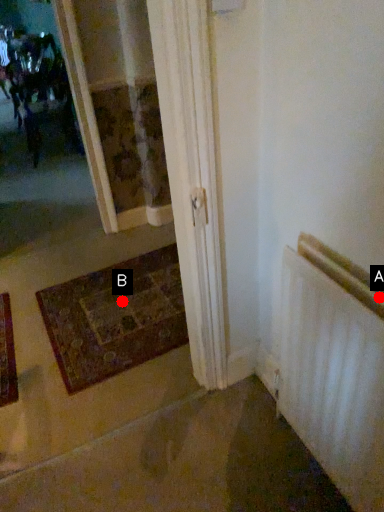
Question: Two points are circled on the image, labeled by A and B beside each circle. Which point is farther from the camera taking this photo?

Choices:
 (A) A is further
 (B) B is further

Answer: (B)